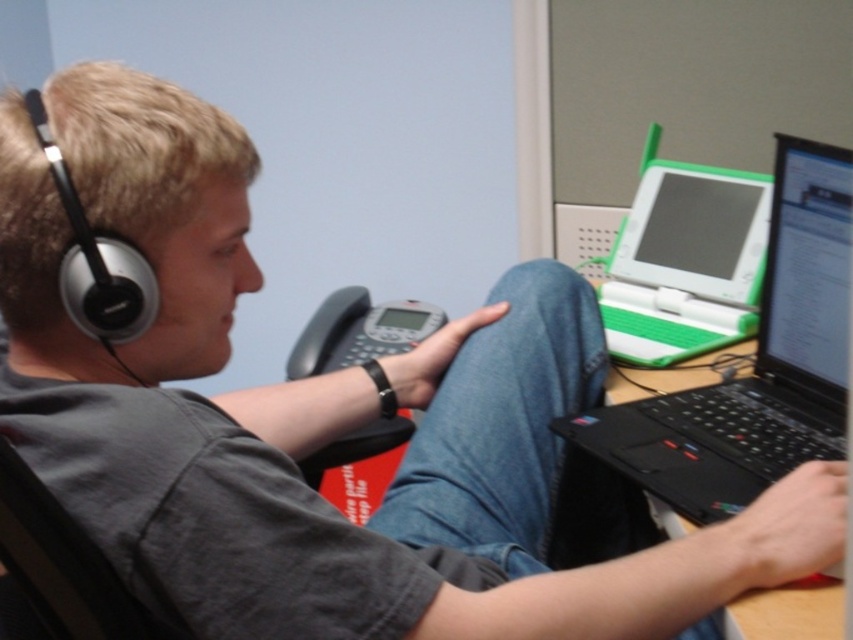
What do you see at coordinates (755, 364) in the screenshot? The image size is (853, 640). I see `black plastic laptop at right` at bounding box center [755, 364].

What are the coordinates of `black plastic laptop at right` in the screenshot? It's located at pyautogui.click(x=755, y=364).

In the scene shown: Who is positioned more to the right, black matte earphone at left or black plastic laptop at lower right?

Positioned to the right is black plastic laptop at lower right.

The width and height of the screenshot is (853, 640). Find the location of `black matte earphone at left`. black matte earphone at left is located at coordinates (96, 259).

Which is in front, point (71, 288) or point (788, 637)?

Point (71, 288)

This screenshot has width=853, height=640. What are the coordinates of `black matte earphone at left` in the screenshot? It's located at (96, 259).

How distant is black plastic laptop at right from black plastic laptop at lower right?

black plastic laptop at right is 7.69 inches from black plastic laptop at lower right.

Between point (838, 328) and point (621, 387), which one is positioned in front?

Positioned in front is point (838, 328).

Locate an element on the screen. black plastic laptop at right is located at coordinates (755, 364).